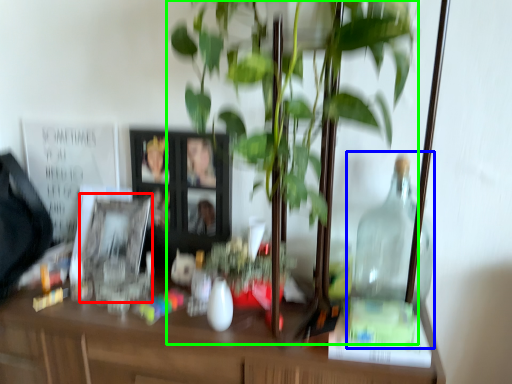
Question: Which object is positioned farthest from picture frame (highlighted by a red box)? Select from glass jar (highlighted by a blue box) and houseplant (highlighted by a green box).

Choices:
 (A) glass jar
 (B) houseplant

Answer: (A)